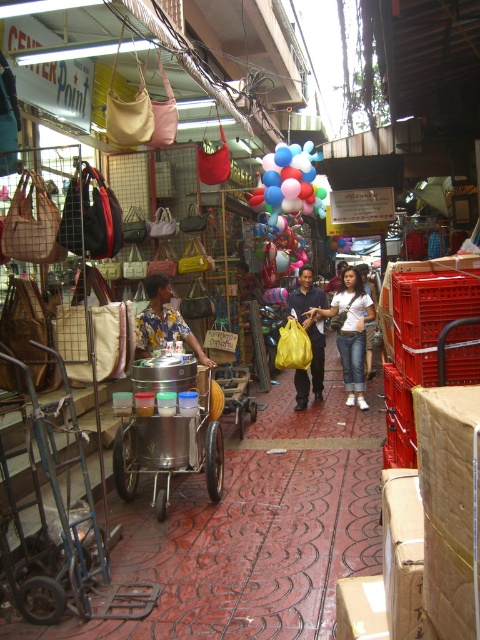
Question: Is brushed metal cart at center further to camera compared to white cotton shirt at center?

Choices:
 (A) no
 (B) yes

Answer: (A)

Question: Which object appears closest to the camera in this image?

Choices:
 (A) brushed metal cart at center
 (B) matte yellow bag at center
 (C) multicolored balloons at center
 (D) floral shirt at center

Answer: (A)

Question: Is metallic silver shopping cart at left to the left of brushed metal cart at center from the viewer's perspective?

Choices:
 (A) yes
 (B) no

Answer: (A)

Question: Among these points, which one is nearest to the camera?

Choices:
 (A) (104, 612)
 (B) (203, 358)
 (C) (144, 467)

Answer: (A)

Question: Which point appears closest to the camera in this image?

Choices:
 (A) pos(171,310)
 (B) pos(364,320)

Answer: (A)

Question: Is multicolored balloons at center thinner than floral shirt at center?

Choices:
 (A) yes
 (B) no

Answer: (B)